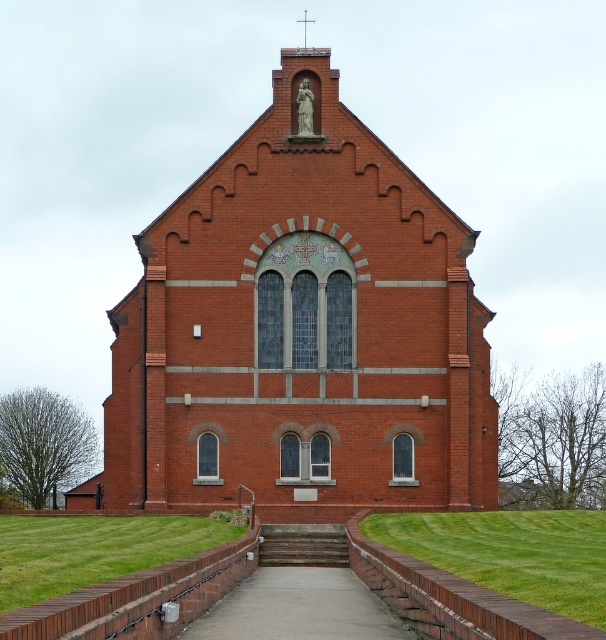
Question: Which of the following is the farthest from the observer?

Choices:
 (A) wooden stairs at center
 (B) concrete at center
 (C) red brick church at center

Answer: (C)

Question: Does red brick church at center appear under wooden stairs at center?

Choices:
 (A) no
 (B) yes

Answer: (A)

Question: Does red brick church at center appear over wooden stairs at center?

Choices:
 (A) no
 (B) yes

Answer: (B)

Question: Based on their relative distances, which object is nearer to the concrete at center?

Choices:
 (A) wooden stairs at center
 (B) red brick church at center

Answer: (A)

Question: Which point appears closest to the camera in this image?

Choices:
 (A) (347, 593)
 (B) (278, 544)

Answer: (A)

Question: Can you confirm if concrete at center is positioned above wooden stairs at center?

Choices:
 (A) no
 (B) yes

Answer: (A)